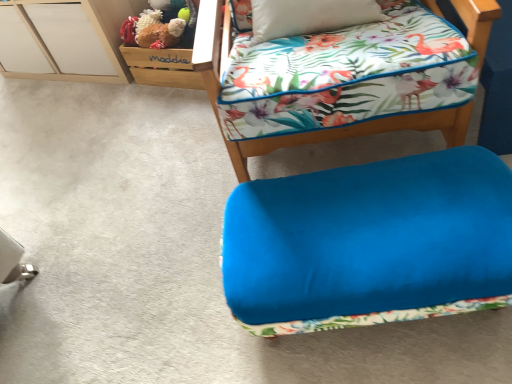
Question: Is velvet blue ottoman at lower center, which appears as the 2th furniture when ordered from the bottom, bigger or smaller than fluffy brown teddy bear at upper left?

Choices:
 (A) big
 (B) small

Answer: (A)

Question: Would you say velvet blue ottoman at lower center, which appears as the 2th furniture when ordered from the bottom, is to the left or to the right of fluffy brown teddy bear at upper left in the picture?

Choices:
 (A) right
 (B) left

Answer: (A)

Question: Which of these objects is positioned closest to the velvet blue ottoman at lower center, which appears as the 2th furniture when ordered from the bottom?

Choices:
 (A) white matte file cabinet at upper left
 (B) velvet blue ottoman at lower right, which appears as the first furniture when ordered from the bottom
 (C) fluffy brown teddy bear at upper left

Answer: (B)

Question: Considering the real-world distances, which object is closest to the white matte file cabinet at upper left?

Choices:
 (A) fluffy brown teddy bear at upper left
 (B) velvet blue ottoman at lower center, arranged as the 1th furniture when viewed from the top
 (C) velvet blue ottoman at lower right, the 2th furniture viewed from the top

Answer: (A)